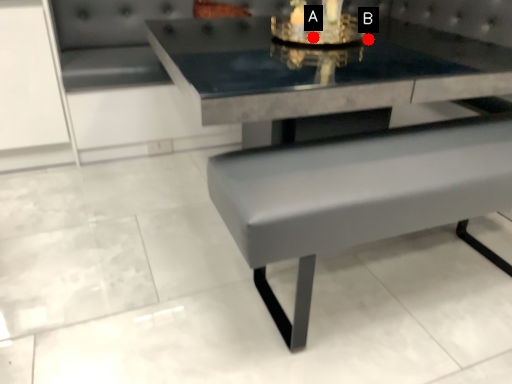
Question: Two points are circled on the image, labeled by A and B beside each circle. Which point appears farthest from the camera in this image?

Choices:
 (A) A is further
 (B) B is further

Answer: (B)